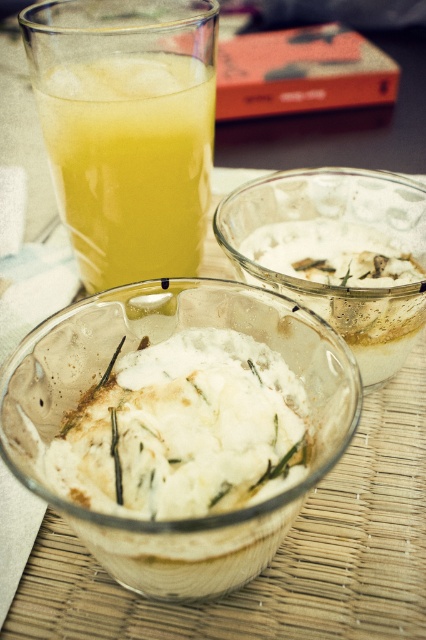
Question: Which point is closer to the camera taking this photo?

Choices:
 (A) (143, 572)
 (B) (412, 216)
 (C) (170, 74)
 (D) (154, 436)

Answer: (A)

Question: Which point is farther from the camera taking this photo?

Choices:
 (A) (282, 356)
 (B) (68, 196)

Answer: (B)

Question: Does white frosted bowl at center appear over white frosted glass bowl at center?

Choices:
 (A) yes
 (B) no

Answer: (B)

Question: Is white frosted bowl at center further to camera compared to white creamy ice cream at center?

Choices:
 (A) yes
 (B) no

Answer: (B)

Question: Which point is closer to the camera?

Choices:
 (A) [x=271, y=481]
 (B) [x=100, y=300]
 (C) [x=420, y=305]
 (D) [x=115, y=177]

Answer: (A)

Question: Where is white frosted bowl at center located in relation to white creamy ice cream at center in the image?

Choices:
 (A) above
 (B) below

Answer: (A)